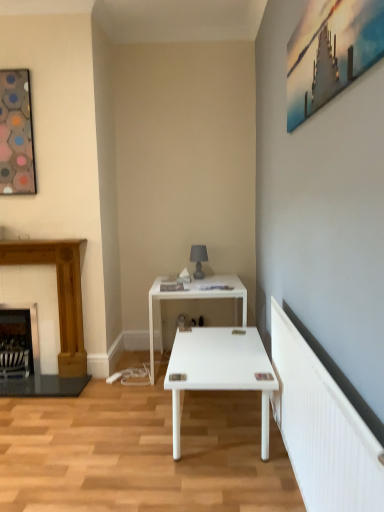
Locate an element on the screen. The height and width of the screenshot is (512, 384). free space in front of wooden fireplace at left, acting as the first fireplace starting from the right is located at coordinates (43, 405).